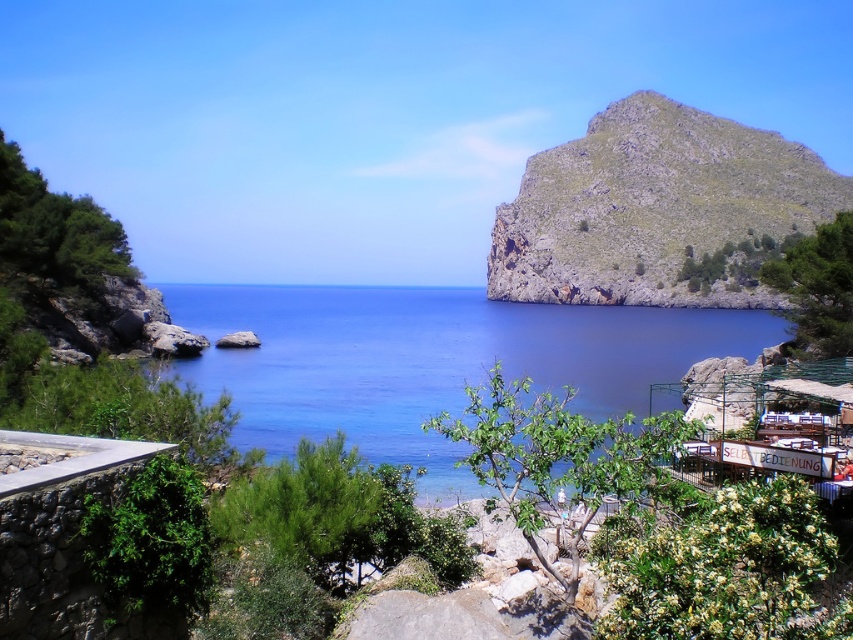
Question: Can you confirm if blue water at center is bigger than green rocky hillside at upper right?

Choices:
 (A) yes
 (B) no

Answer: (B)

Question: Does blue water at center come behind green rocky hillside at upper right?

Choices:
 (A) no
 (B) yes

Answer: (A)

Question: Is blue water at center thinner than green rocky hillside at upper right?

Choices:
 (A) no
 (B) yes

Answer: (A)

Question: Which point is farther from the camera taking this photo?

Choices:
 (A) (368, 332)
 (B) (521, 198)

Answer: (B)

Question: Which object appears farthest from the camera in this image?

Choices:
 (A) green rocky hillside at upper right
 (B) blue water at center

Answer: (A)

Question: Which object appears closest to the camera in this image?

Choices:
 (A) green rocky hillside at upper right
 (B) blue water at center

Answer: (B)